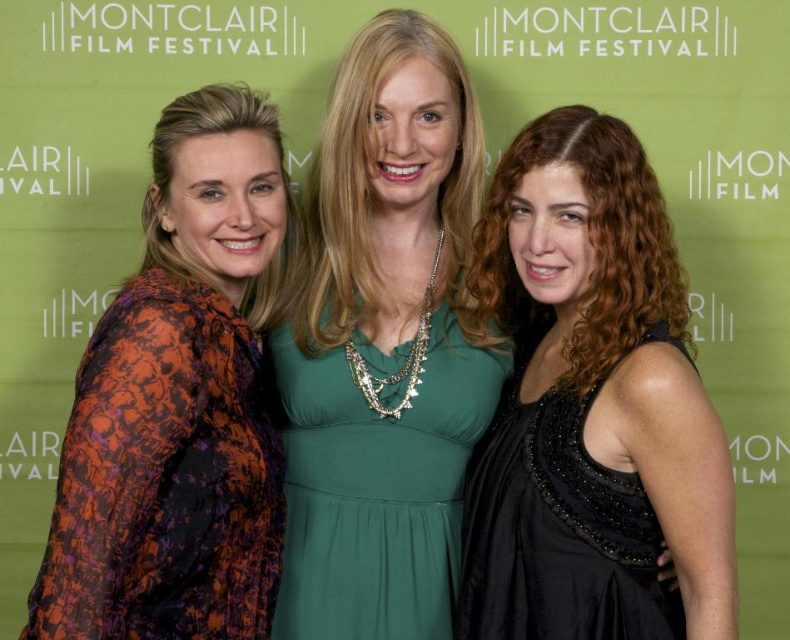
Question: Can you confirm if orange floral dress at left is thinner than emerald green jersey dress at center?

Choices:
 (A) yes
 (B) no

Answer: (A)

Question: Which of these objects is positioned closest to the orange floral dress at left?

Choices:
 (A) emerald green jersey dress at center
 (B) black satin dress at right

Answer: (A)

Question: Observing the image, what is the correct spatial positioning of orange floral dress at left in reference to black satin dress at right?

Choices:
 (A) below
 (B) above

Answer: (B)

Question: Which of the following is the closest to the observer?

Choices:
 (A) (593, 563)
 (B) (292, 545)
 (C) (160, 544)

Answer: (C)

Question: Which of the following is the farthest from the observer?

Choices:
 (A) black satin dress at right
 (B) emerald green jersey dress at center

Answer: (B)

Question: Is emerald green jersey dress at center wider than black satin dress at right?

Choices:
 (A) yes
 (B) no

Answer: (A)